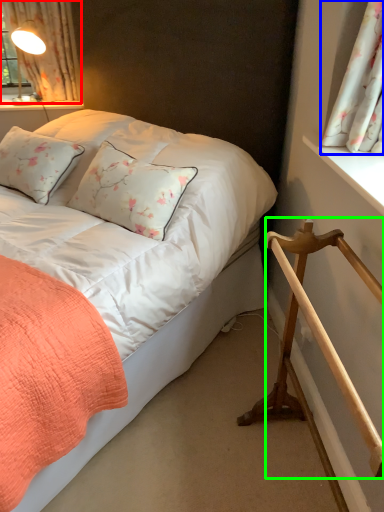
Question: Which is nearer to the curtain (highlighted by a red box)? curtain (highlighted by a blue box) or rail (highlighted by a green box).

Choices:
 (A) curtain
 (B) rail

Answer: (A)